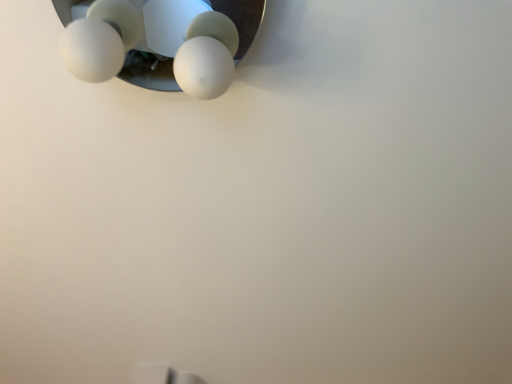
Question: Should I look upward or downward to see white matte egg at upper left?

Choices:
 (A) down
 (B) up

Answer: (B)